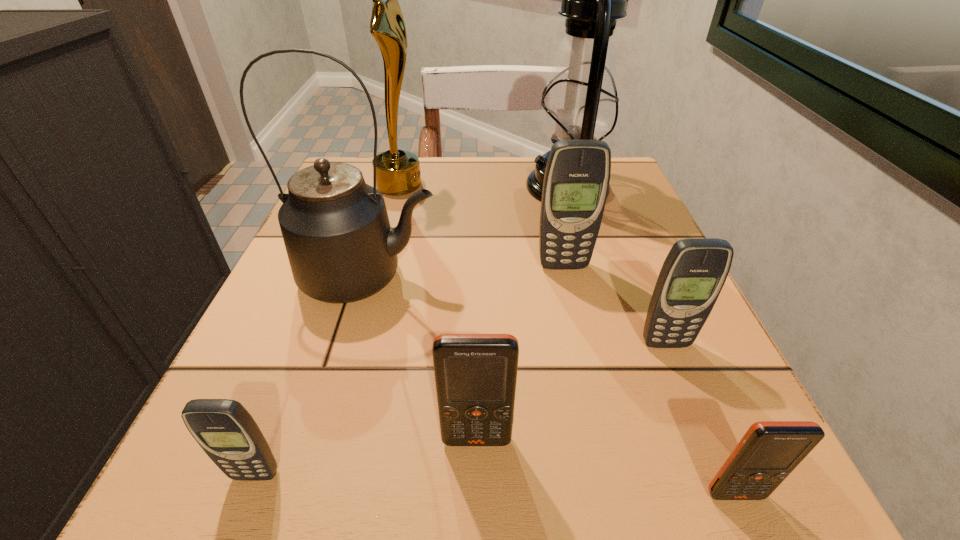
Locate an element on the screen. the nearer orange cellular telephone is located at coordinates (769, 451).

Image resolution: width=960 pixels, height=540 pixels. Identify the location of the leftmost cellular telephone. (224, 429).

You are a GUI agent. You are given a task and a screenshot of the screen. Output one action in this format:
    pyautogui.click(x=<x>, y=<y>)
    Task: Click on the seventh farthest object
    This screenshot has height=540, width=960.
    Given the screenshot: What is the action you would take?
    pyautogui.click(x=224, y=429)

At what (x,y) coordinates should I click in order to perform the action: click on free region located 0.210m on the front of the black oil lamp. Please return your answer as a coordinate pair (x, y). This screenshot has width=960, height=540. Looking at the image, I should click on (596, 284).

This screenshot has height=540, width=960. What are the coordinates of `vacant space located 0.310m on the front-facing side of the award` in the screenshot? It's located at (563, 184).

You are a GUI agent. You are given a task and a screenshot of the screen. Output one action in this format:
    pyautogui.click(x=<x>, y=<y>)
    Task: Click on the vacant space situated 0.250m spout on the sixth shortest object
    This screenshot has width=960, height=540.
    Given the screenshot: What is the action you would take?
    pyautogui.click(x=588, y=278)

Identify the location of free space located 0.360m on the screen of the biggest gray cellular telephone. Image resolution: width=960 pixels, height=540 pixels. (612, 483).

Identify the location of free space located on the screen of the fourth nearest cellular telephone. (693, 411).

The height and width of the screenshot is (540, 960). In order to click on oil lamp situated at the far edge in this screenshot , I will do `click(580, 102)`.

This screenshot has width=960, height=540. Find the location of `award positioned at the far edge`. award positioned at the far edge is located at coordinates (398, 172).